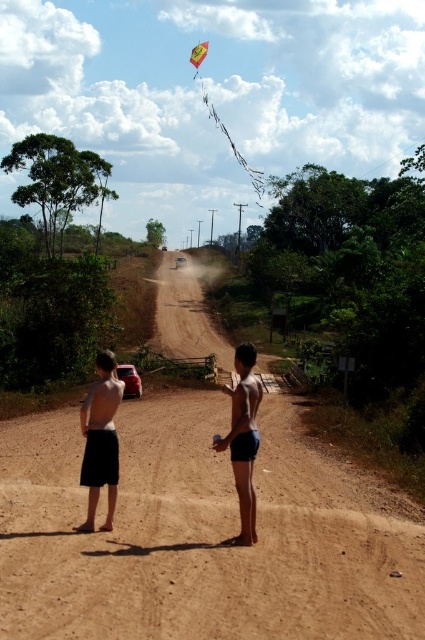
You are standing at the center of the road and see the point marked at coordinate point (243, 438). What color shorts are the person wearing at that point?

The person at point (243, 438) is wearing smooth blue shorts.

You are a photographer trying to capture the two boys and their kite in the scene. Since the smooth blue shorts at center and the yellow fabric kite at upper center are both in your frame, can you determine which one appears narrower in the photo?

The smooth blue shorts at center appears narrower than the yellow fabric kite at upper center because its width is less than that of the kite.